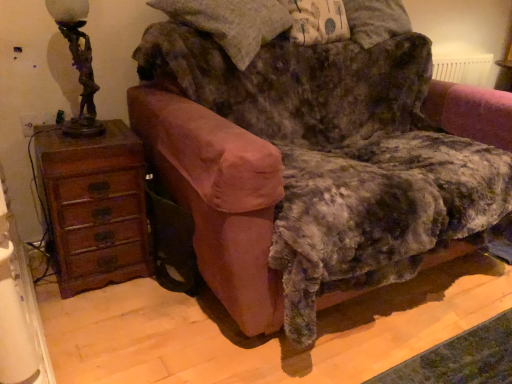
Locate an element on the screen. vacant space in front of brown wooden chest of drawers at left is located at coordinates (95, 316).